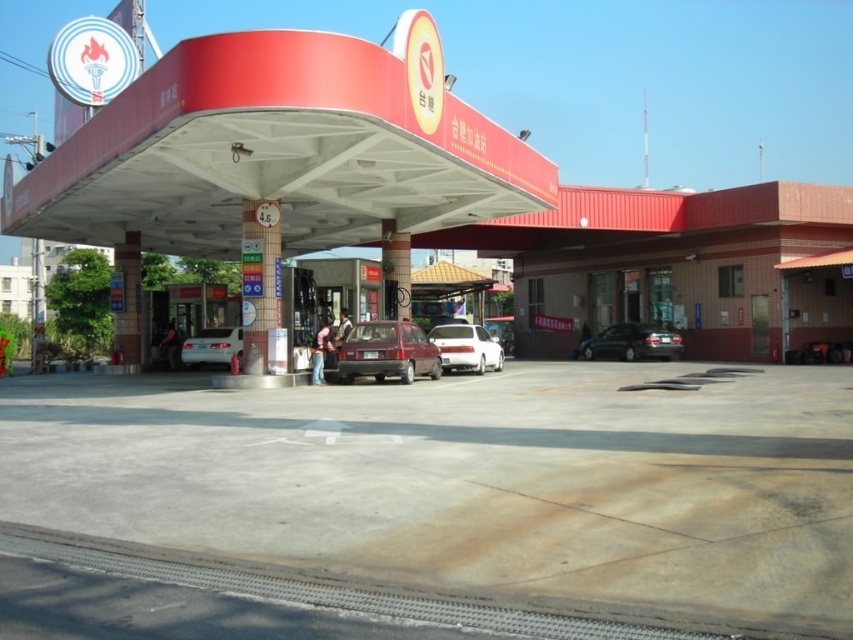
Question: Is matte red car at center above satin silver sedan at center?

Choices:
 (A) yes
 (B) no

Answer: (B)

Question: From the image, what is the correct spatial relationship of white glossy sedan at center in relation to satin silver sedan at center?

Choices:
 (A) left
 (B) right

Answer: (B)

Question: Based on their relative distances, which object is farther from the matte red gas station at center?

Choices:
 (A) metallic sign at center
 (B) shiny black sedan at center

Answer: (B)

Question: Can you confirm if shiny black sedan at center is positioned below white glossy sedan at center?

Choices:
 (A) yes
 (B) no

Answer: (A)

Question: Which point is closer to the camera?

Choices:
 (A) (660, 339)
 (B) (270, 218)
 (C) (444, 92)
 (D) (485, 348)

Answer: (C)

Question: Which object appears farthest from the camera in this image?

Choices:
 (A) white glossy sedan at center
 (B) metallic sign at center
 (C) matte red gas station at center

Answer: (A)